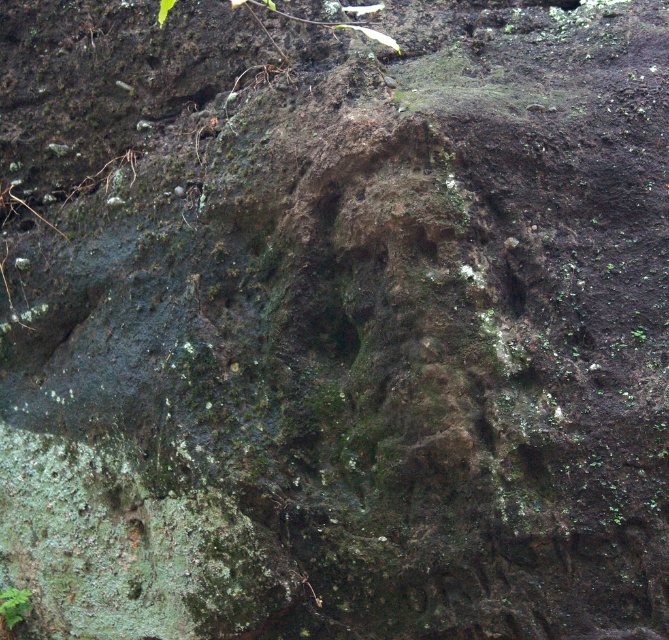
You are a botanist examining the rock surface. You notice two green mossy plants. Which one is closer to you, the green mossy plant at lower left or the green mossy plant at center?

The green mossy plant at lower left is closer to you because the green mossy plant at center is behind it.

You are a botanist examining the rock surface. You notice two green mossy plants. Where is the green mossy plant at lower left in relation to the green mossy plant at center?

The green mossy plant at lower left is located below the green mossy plant at center.